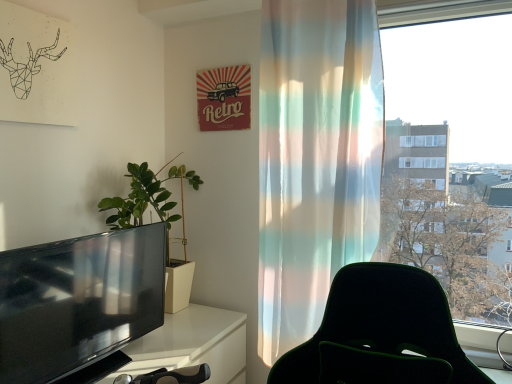
Question: Is the depth of translucent fabric curtain at right greater than that of black glossy television at left?

Choices:
 (A) yes
 (B) no

Answer: (A)

Question: Are translucent fabric curtain at right and black glossy television at left beside each other?

Choices:
 (A) yes
 (B) no

Answer: (B)

Question: Can you confirm if translucent fabric curtain at right is bigger than black glossy television at left?

Choices:
 (A) no
 (B) yes

Answer: (B)

Question: From the image's perspective, is translucent fabric curtain at right located above black glossy television at left?

Choices:
 (A) yes
 (B) no

Answer: (A)

Question: From a real-world perspective, is translucent fabric curtain at right positioned under black glossy television at left based on gravity?

Choices:
 (A) yes
 (B) no

Answer: (B)

Question: Relative to black glossy television at left, is green matte plant at left in front or behind?

Choices:
 (A) behind
 (B) front

Answer: (A)

Question: Considering the positions of green matte plant at left and black glossy television at left in the image, is green matte plant at left bigger or smaller than black glossy television at left?

Choices:
 (A) big
 (B) small

Answer: (A)

Question: Looking at their shapes, would you say green matte plant at left is wider or thinner than black glossy television at left?

Choices:
 (A) wide
 (B) thin

Answer: (A)

Question: Is point 158,187 closer or farther from the camera than point 53,276?

Choices:
 (A) closer
 (B) farther

Answer: (B)

Question: Considering the positions of green matte plant at left and translucent fabric curtain at right in the image, is green matte plant at left taller or shorter than translucent fabric curtain at right?

Choices:
 (A) short
 (B) tall

Answer: (A)

Question: Is green matte plant at left in front of or behind translucent fabric curtain at right in the image?

Choices:
 (A) behind
 (B) front

Answer: (A)

Question: In the image, is green matte plant at left on the left side or the right side of translucent fabric curtain at right?

Choices:
 (A) right
 (B) left

Answer: (B)

Question: Looking at their shapes, would you say green matte plant at left is wider or thinner than translucent fabric curtain at right?

Choices:
 (A) wide
 (B) thin

Answer: (A)

Question: Considering their positions, is black glossy television at left located in front of or behind translucent fabric curtain at right?

Choices:
 (A) front
 (B) behind

Answer: (A)

Question: In terms of size, does black glossy television at left appear bigger or smaller than translucent fabric curtain at right?

Choices:
 (A) small
 (B) big

Answer: (A)